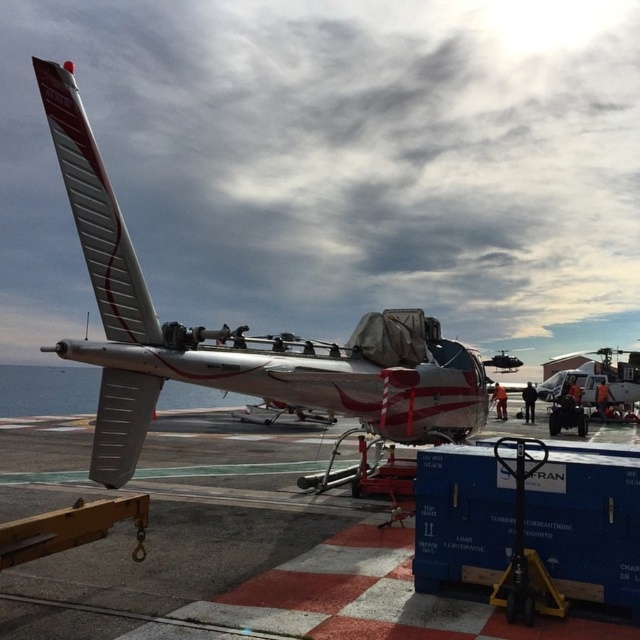
Can you confirm if smooth concrete tarmac at center is positioned above silver metallic airplane at center?

Incorrect, smooth concrete tarmac at center is not positioned above silver metallic airplane at center.

Identify the location of smooth concrete tarmac at center. (260, 548).